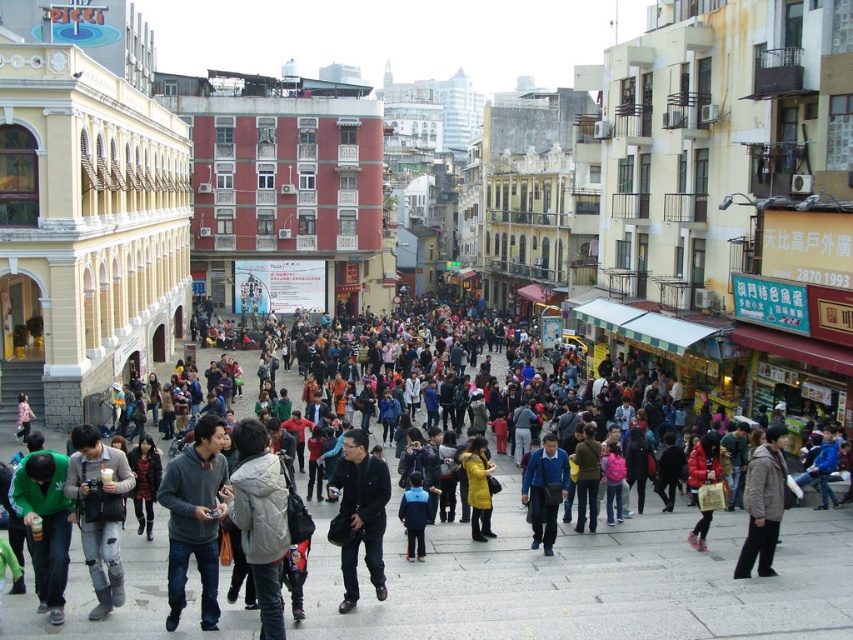
Question: Considering the relative positions of gray concrete pavement at center and ripped jeans at lower left in the image provided, where is gray concrete pavement at center located with respect to ripped jeans at lower left?

Choices:
 (A) right
 (B) left

Answer: (A)

Question: Is white fuzzy jacket at center bigger than light brown leather jacket at lower right?

Choices:
 (A) yes
 (B) no

Answer: (B)

Question: Is matte gray building at center above gray fleece jacket at center?

Choices:
 (A) no
 (B) yes

Answer: (B)

Question: Which of the following is the closest to the observer?

Choices:
 (A) ripped jeans at lower left
 (B) dark blue jacket at center
 (C) matte gray building at center
 (D) blue fabric jacket at center

Answer: (A)

Question: Based on their relative distances, which object is nearer to the white fuzzy jacket at center?

Choices:
 (A) blue matte jacket at center
 (B) dark blue jacket at center
 (C) yellow matte coat at center

Answer: (B)

Question: Which object is positioned farthest from the gray concrete pavement at center?

Choices:
 (A) white fuzzy jacket at center
 (B) gray fleece jacket at center

Answer: (B)